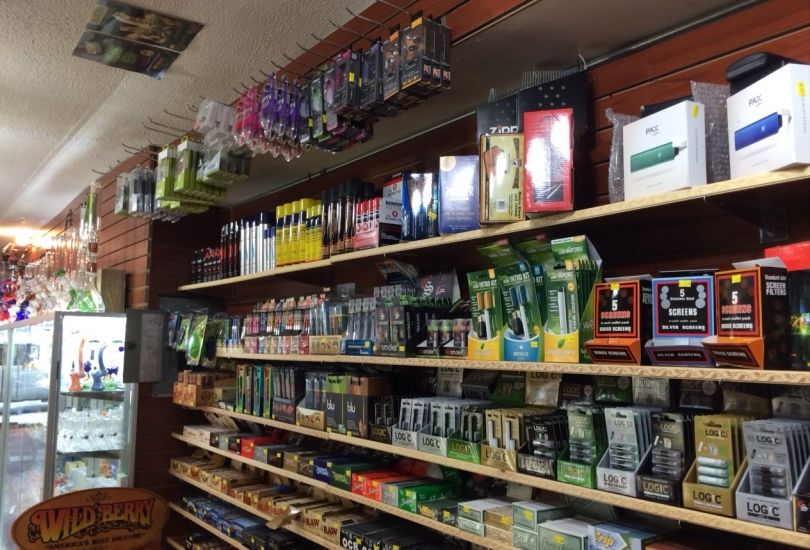
Where is `pens`? The height and width of the screenshot is (550, 810). pens is located at coordinates (288, 328).